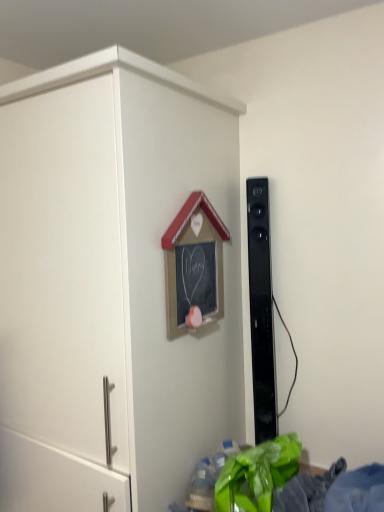
Question: In the image, is black glossy speaker at right on the left side or the right side of white matte cupboard at center?

Choices:
 (A) right
 (B) left

Answer: (A)

Question: From their relative heights in the image, would you say black glossy speaker at right is taller or shorter than white matte cupboard at center?

Choices:
 (A) short
 (B) tall

Answer: (A)

Question: Considering the positions of point (246, 207) and point (18, 474), is point (246, 207) closer or farther from the camera than point (18, 474)?

Choices:
 (A) closer
 (B) farther

Answer: (B)

Question: Based on their positions, is white matte cupboard at center located to the left or right of black glossy speaker at right?

Choices:
 (A) left
 (B) right

Answer: (A)

Question: Does point (145, 237) appear closer or farther from the camera than point (248, 291)?

Choices:
 (A) closer
 (B) farther

Answer: (A)

Question: Considering the positions of white matte cupboard at center and black glossy speaker at right in the image, is white matte cupboard at center taller or shorter than black glossy speaker at right?

Choices:
 (A) short
 (B) tall

Answer: (B)

Question: Relative to black glossy speaker at right, is white matte cupboard at center in front or behind?

Choices:
 (A) front
 (B) behind

Answer: (A)